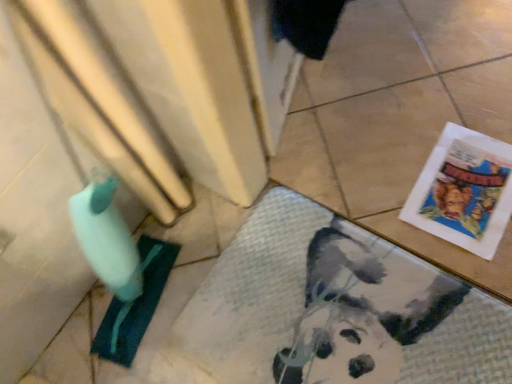
Question: Is white paper comic book at lower right next to white textured bath mat at lower right and touching it?

Choices:
 (A) yes
 (B) no

Answer: (B)

Question: Does white paper comic book at lower right have a lesser height compared to white textured bath mat at lower right?

Choices:
 (A) yes
 (B) no

Answer: (A)

Question: Is white paper comic book at lower right aimed at white textured bath mat at lower right?

Choices:
 (A) yes
 (B) no

Answer: (A)

Question: Can you confirm if white paper comic book at lower right is thinner than white textured bath mat at lower right?

Choices:
 (A) no
 (B) yes

Answer: (B)

Question: Is white paper comic book at lower right far from white textured bath mat at lower right?

Choices:
 (A) yes
 (B) no

Answer: (B)

Question: From a real-world perspective, is white paper comic book at lower right physically below white textured bath mat at lower right?

Choices:
 (A) yes
 (B) no

Answer: (B)

Question: Is white textured bath mat at lower right at the right side of white paper comic book at lower right?

Choices:
 (A) yes
 (B) no

Answer: (B)

Question: Is white textured bath mat at lower right oriented away from white paper comic book at lower right?

Choices:
 (A) yes
 (B) no

Answer: (A)

Question: Considering the relative sizes of white textured bath mat at lower right and white paper comic book at lower right in the image provided, is white textured bath mat at lower right smaller than white paper comic book at lower right?

Choices:
 (A) no
 (B) yes

Answer: (A)

Question: Can you confirm if white textured bath mat at lower right is bigger than white paper comic book at lower right?

Choices:
 (A) no
 (B) yes

Answer: (B)

Question: From a real-world perspective, is white textured bath mat at lower right below white paper comic book at lower right?

Choices:
 (A) yes
 (B) no

Answer: (A)

Question: Is white textured bath mat at lower right facing towards white paper comic book at lower right?

Choices:
 (A) no
 (B) yes

Answer: (A)

Question: Looking at the image, does white paper comic book at lower right seem bigger or smaller compared to white textured bath mat at lower right?

Choices:
 (A) small
 (B) big

Answer: (A)